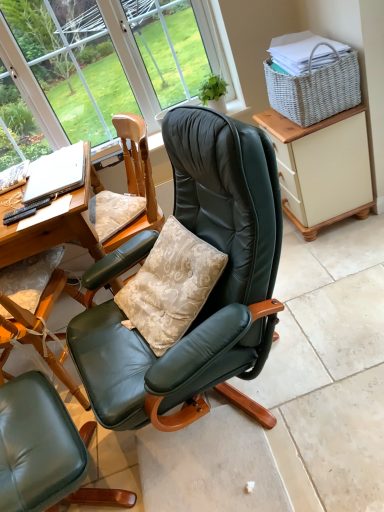
Question: Considering the positions of point (317, 145) and point (8, 223), is point (317, 145) closer or farther from the camera than point (8, 223)?

Choices:
 (A) farther
 (B) closer

Answer: (A)

Question: Would you say beige painted cabinet at right is to the left or to the right of black plastic remote control at lower left in the picture?

Choices:
 (A) left
 (B) right

Answer: (B)

Question: Considering the real-world distances, which object is farthest from the white woven picnic basket at upper right?

Choices:
 (A) silver metallic laptop at left
 (B) black plastic remote control at lower left
 (C) matte green leather chair at center
 (D) beige painted cabinet at right
 (E) matte glass window at upper center

Answer: (C)

Question: Considering the real-world distances, which object is farthest from the matte green leather chair at center?

Choices:
 (A) matte glass window at upper center
 (B) beige painted cabinet at right
 (C) white woven picnic basket at upper right
 (D) black plastic remote control at lower left
 (E) silver metallic laptop at left

Answer: (A)